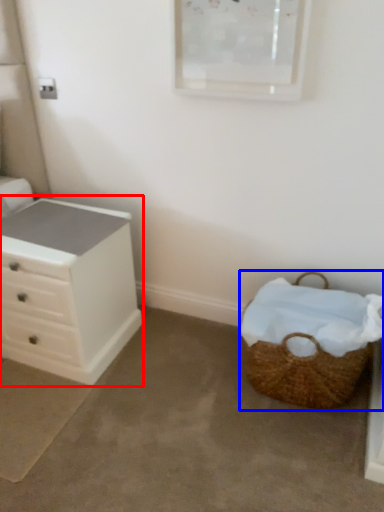
Question: Which point is further to the camera, chest of drawers (highlighted by a red box) or picnic basket (highlighted by a blue box)?

Choices:
 (A) chest of drawers
 (B) picnic basket

Answer: (A)